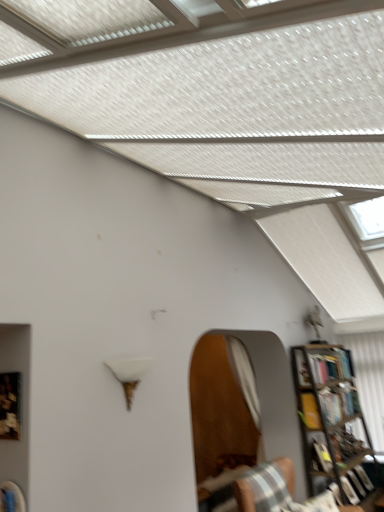
Question: Considering the positions of white fabric curtain at right and hardcover book at right in the image, is white fabric curtain at right wider or thinner than hardcover book at right?

Choices:
 (A) wide
 (B) thin

Answer: (B)

Question: From the image's perspective, is white fabric curtain at right above or below hardcover book at right?

Choices:
 (A) below
 (B) above

Answer: (A)

Question: Based on their relative distances, which object is farther from the white fabric curtain at right?

Choices:
 (A) hardcover book at right
 (B) metallic bookcase at right
 (C) striped fabric chair at lower right

Answer: (C)

Question: Which object is the farthest from the hardcover book at right?

Choices:
 (A) metallic bookcase at right
 (B) striped fabric chair at lower right
 (C) white fabric curtain at right

Answer: (B)